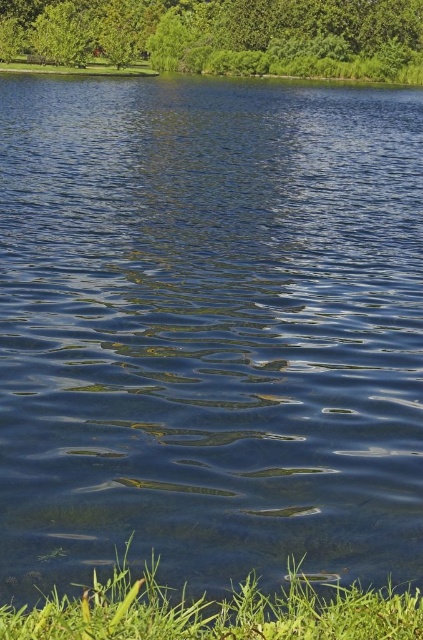
Locate an element on the screen. green leafy tree at upper center is located at coordinates (224, 35).

Who is more distant from viewer, [99,56] or [186,618]?

The point [99,56] is behind.

Between point (52, 51) and point (343, 634), which one is positioned behind?

The point (52, 51) is more distant.

Locate an element on the screen. green leafy tree at upper center is located at coordinates (224, 35).